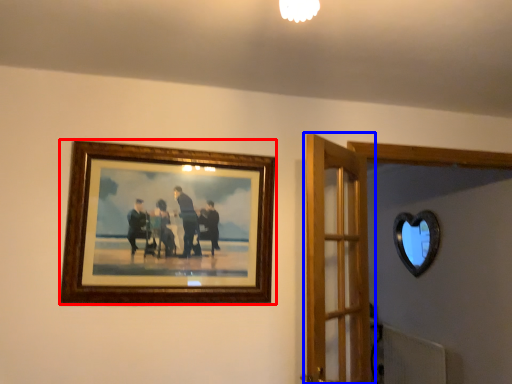
Question: Which of the following is the closest to the observer, picture frame (highlighted by a red box) or door (highlighted by a blue box)?

Choices:
 (A) picture frame
 (B) door

Answer: (B)